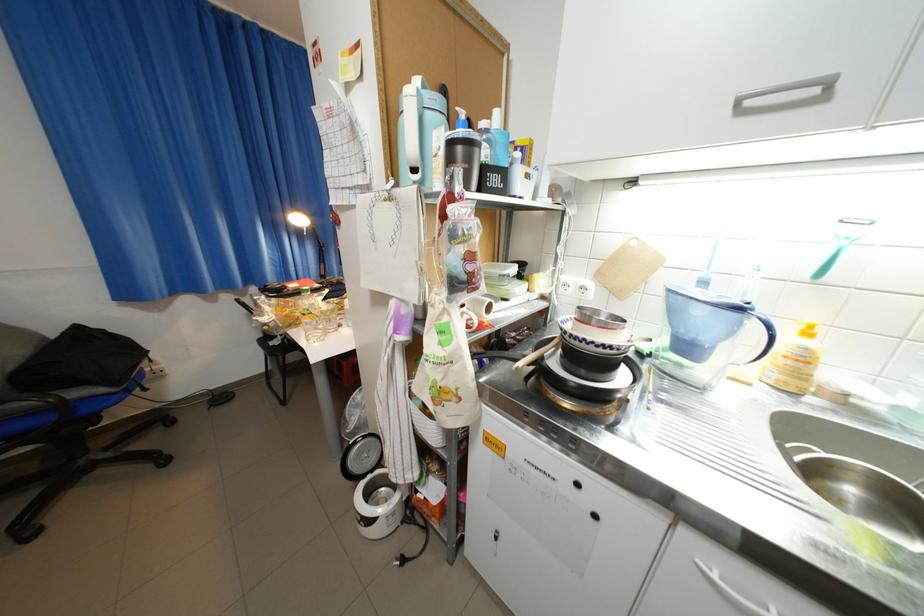
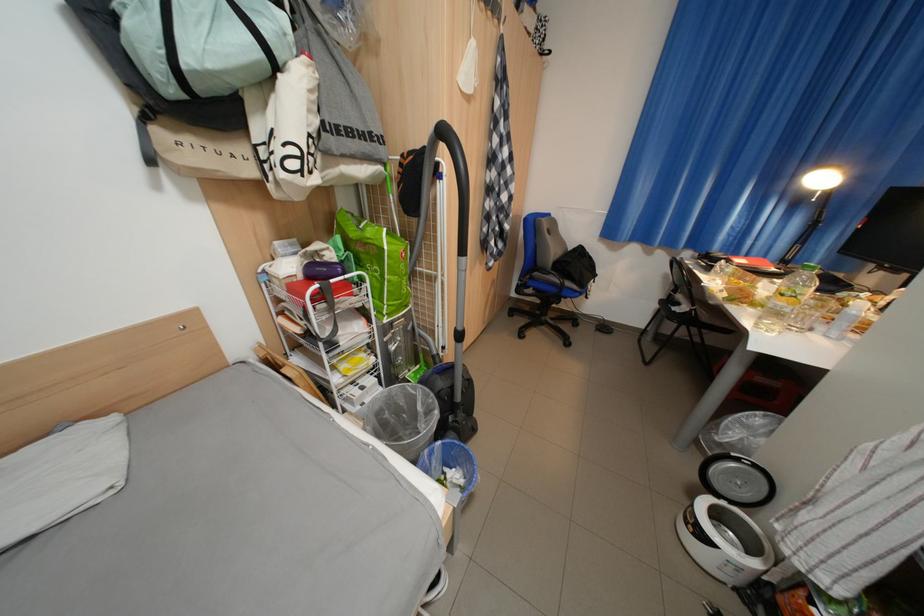
The images are taken continuously from a first-person perspective. In which direction is your viewpoint rotating?

The camera rotated toward left-down.